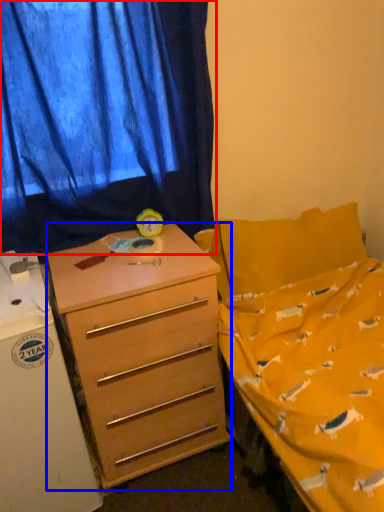
Question: Which of the following is the farthest to the observer, curtain (highlighted by a red box) or desk (highlighted by a blue box)?

Choices:
 (A) curtain
 (B) desk

Answer: (A)